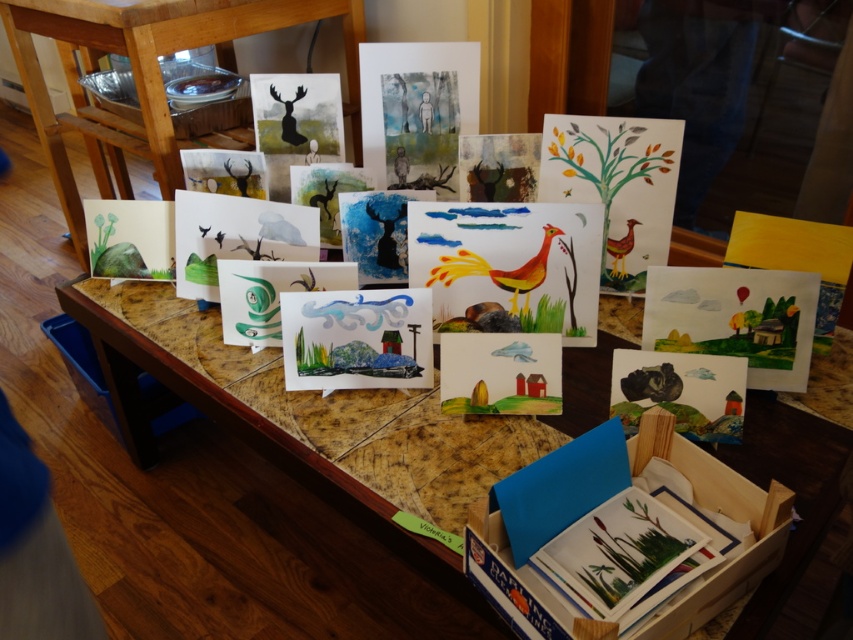
You are standing at the edge of the wooden table and want to place a new drawing exactly at point (144, 76). Based on the scene description, where should you place the drawing?

Place the new drawing at the wooden table at upper left, as the point (144, 76) is located there.

You have a small decorative item that is 15 cm wide. You want to place it on the wooden table at center without it overlapping the matte black deer at upper center. Is there enough space on the table for this?

The wooden table at center is wider than the matte black deer at upper center, so there should be enough space to place the 15 cm wide decorative item without overlapping the deer.

You are a parent trying to place a new drawing on the wooden table at center. The matte black deer at upper center is currently blocking the area where you want to place it. Can you move the deer to make space without needing to lift the table?

The wooden table at center has a greater height compared to matte black deer at upper center, so you can move the deer by lifting it off the table since the table is taller than the deer.